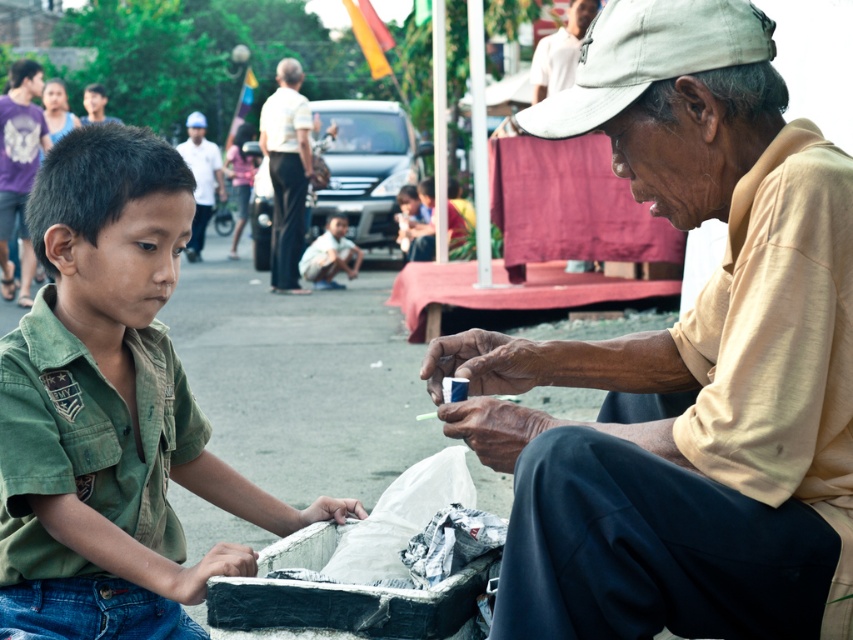
You are a fashion designer observing this scene and want to create a layered look using the light beige cotton shirt at right and the white cotton shirt at upper center. Based on their current positions in the image, which shirt should be placed on top to maintain the same visual hierarchy?

The light beige cotton shirt at right is positioned under the white cotton shirt at upper center, so to maintain the same visual hierarchy, the white cotton shirt at upper center should be placed on top of the light beige cotton shirt at right.

You are standing in the street scene and want to locate the green matte shirt at left. Can you tell me its exact position in the image?

The green matte shirt at left is located at the 2D coordinates point (x=109, y=410) in the image.

You are a delivery person trying to deliver a package to the older man in the scene. The package can only be carried by someone who is at least 1.5 meters away from the green matte shirt at left. Are you able to safely deliver the package to the white cotton shirt at upper center?

The green matte shirt at left and white cotton shirt at upper center are 10.93 meters apart from each other. Since 10.93 meters is greater than 1.5 meters, you can safely deliver the package to the white cotton shirt at upper center.